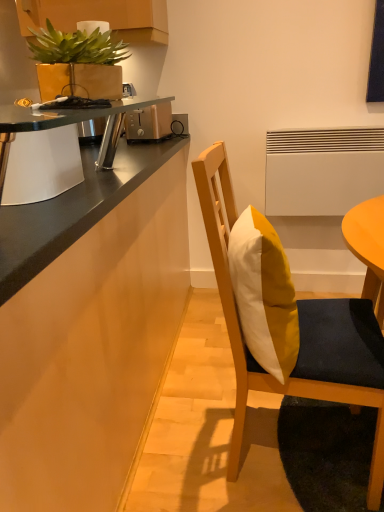
Question: Is metallic silver desk at upper left wider or thinner than satin gold toaster at upper center?

Choices:
 (A) thin
 (B) wide

Answer: (A)

Question: From a real-world perspective, is metallic silver desk at upper left positioned above or below satin gold toaster at upper center?

Choices:
 (A) below
 (B) above

Answer: (B)

Question: Which of these objects is positioned closest to the satin gold toaster at upper center?

Choices:
 (A) metallic silver desk at upper left
 (B) wooden chair with cushion at center
 (C) matte wood cabinetry at left
 (D) yellow matte pillow at center
 (E) matte gold pot at upper left

Answer: (A)

Question: Which of these objects is positioned farthest from the wooden chair with cushion at center?

Choices:
 (A) matte wood cabinetry at left
 (B) yellow matte pillow at center
 (C) matte gold pot at upper left
 (D) metallic silver desk at upper left
 (E) satin gold toaster at upper center

Answer: (E)